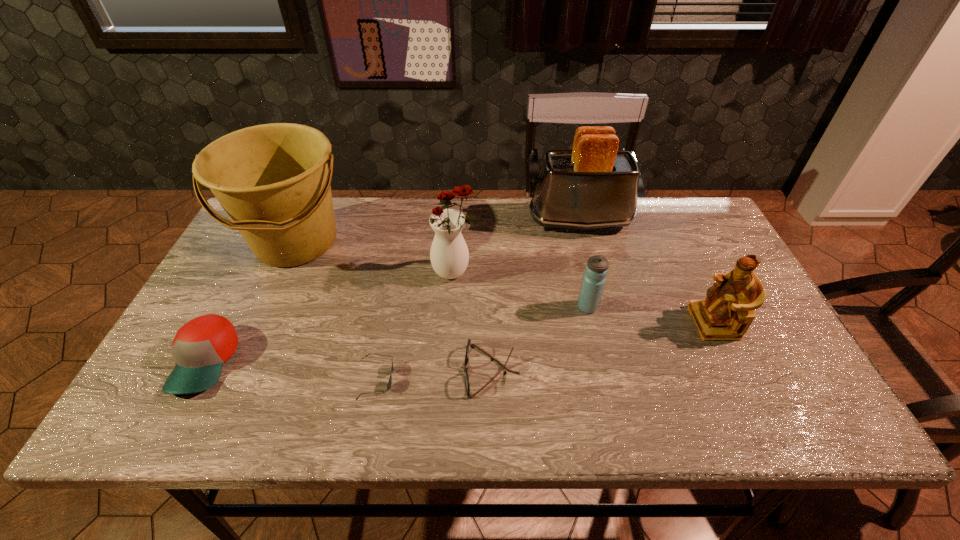
The image size is (960, 540). What are the coordinates of `object present at the right edge` in the screenshot? It's located at (727, 312).

Image resolution: width=960 pixels, height=540 pixels. Identify the location of object located at the far left corner. (272, 180).

You are a GUI agent. You are given a task and a screenshot of the screen. Output one action in this format:
    pyautogui.click(x=<x>, y=<y>)
    Task: Click on the object that is at the near left corner
    The height and width of the screenshot is (540, 960).
    Given the screenshot: What is the action you would take?
    pyautogui.click(x=200, y=347)

Where is `vacant space at the far edge of the desktop`? Image resolution: width=960 pixels, height=540 pixels. vacant space at the far edge of the desktop is located at coordinates (634, 230).

The image size is (960, 540). Identify the location of free region at the near edge. (325, 433).

Locate an element on the screen. The height and width of the screenshot is (540, 960). vacant space at the left edge is located at coordinates (266, 278).

This screenshot has width=960, height=540. I want to click on free space at the right edge of the desktop, so click(701, 273).

In order to click on vacant space at the near left corner of the desktop in this screenshot , I will do tap(140, 428).

The width and height of the screenshot is (960, 540). In order to click on vacant space at the far right corner of the desktop in this screenshot , I will do `click(680, 205)`.

Locate an element on the screen. The image size is (960, 540). vacant area between the figurine and the toaster is located at coordinates (647, 272).